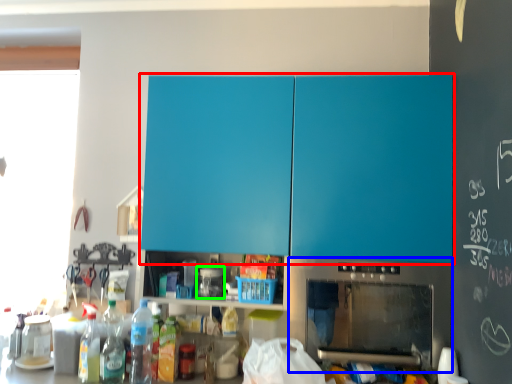
Question: Based on their relative distances, which object is farther from cabinetry (highlighted by a red box)? Choose from home appliance (highlighted by a blue box) and appliance (highlighted by a green box).

Choices:
 (A) home appliance
 (B) appliance

Answer: (B)